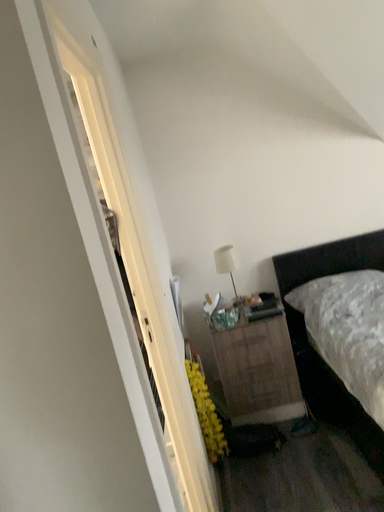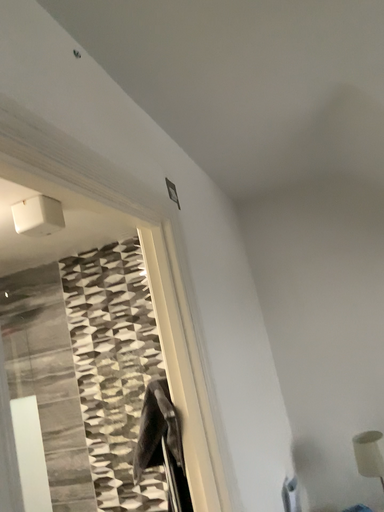
Question: Which way did the camera rotate in the video?

Choices:
 (A) rotated right
 (B) rotated left

Answer: (B)